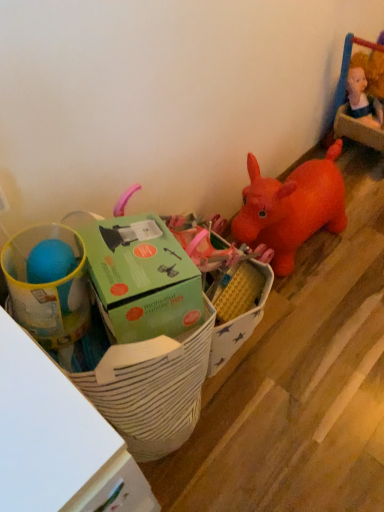
Question: From the image's perspective, is green cardboard box at center beneath matte plastic cup at left, positioned as the first toy in left-to-right order?

Choices:
 (A) yes
 (B) no

Answer: (A)

Question: Is matte plastic cup at left, positioned as the first toy in left-to-right order, at the back of green cardboard box at center?

Choices:
 (A) yes
 (B) no

Answer: (B)

Question: Is green cardboard box at center thinner than matte plastic cup at left, the 2th toy positioned from the right?

Choices:
 (A) yes
 (B) no

Answer: (B)

Question: Is green cardboard box at center outside matte plastic cup at left, positioned as the first toy in left-to-right order?

Choices:
 (A) yes
 (B) no

Answer: (A)

Question: Could you tell me if green cardboard box at center is facing matte plastic cup at left, the 2th toy positioned from the right?

Choices:
 (A) no
 (B) yes

Answer: (A)

Question: Considering the relative positions of green cardboard box at center and matte plastic cup at left, the 2th toy positioned from the right, in the image provided, is green cardboard box at center to the left of matte plastic cup at left, the 2th toy positioned from the right, from the viewer's perspective?

Choices:
 (A) yes
 (B) no

Answer: (B)

Question: Does green cardboard box at center lie in front of green cardboard box at left, arranged as the 1th toy when viewed from the right?

Choices:
 (A) yes
 (B) no

Answer: (B)

Question: Considering the relative sizes of green cardboard box at center and green cardboard box at left, arranged as the 1th toy when viewed from the right, in the image provided, is green cardboard box at center taller than green cardboard box at left, arranged as the 1th toy when viewed from the right,?

Choices:
 (A) no
 (B) yes

Answer: (B)

Question: From the image's perspective, would you say green cardboard box at center is shown under green cardboard box at left, which is the 2th toy from left to right?

Choices:
 (A) yes
 (B) no

Answer: (A)

Question: Can you confirm if green cardboard box at center is wider than green cardboard box at left, which is the 2th toy from left to right?

Choices:
 (A) no
 (B) yes

Answer: (B)

Question: Would you say green cardboard box at center is outside green cardboard box at left, arranged as the 1th toy when viewed from the right?

Choices:
 (A) no
 (B) yes

Answer: (B)

Question: Does green cardboard box at center appear on the right side of green cardboard box at left, which is the 2th toy from left to right?

Choices:
 (A) yes
 (B) no

Answer: (A)

Question: Can you confirm if green cardboard box at left, which is the 2th toy from left to right, is wider than white striped fabric basket at lower left?

Choices:
 (A) no
 (B) yes

Answer: (A)